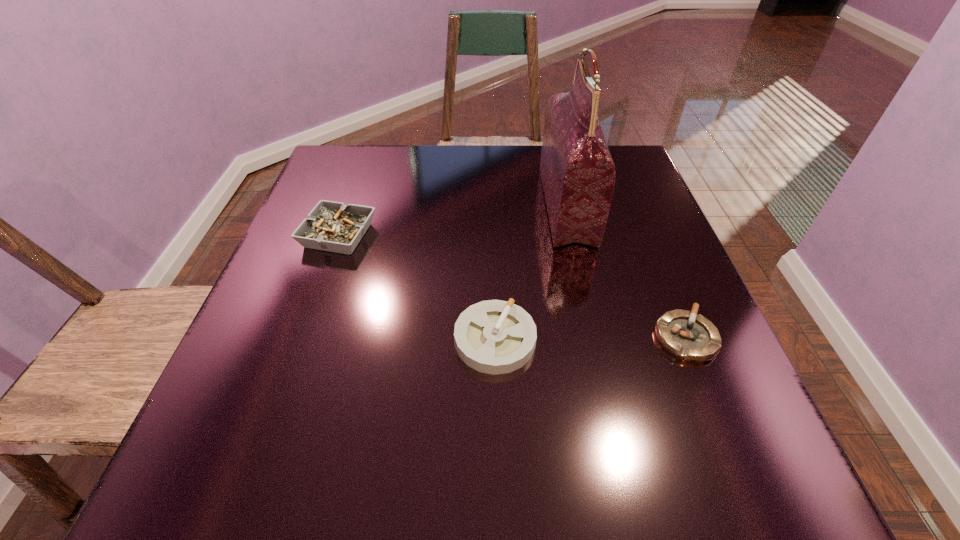
The image size is (960, 540). I want to click on free spot at the right edge of the desktop, so click(636, 199).

The width and height of the screenshot is (960, 540). I want to click on vacant space at the far left corner of the desktop, so click(349, 184).

I want to click on blank space at the near left corner, so click(x=304, y=449).

At what (x,y) coordinates should I click in order to perform the action: click on free space at the far right corner. Please return your answer as a coordinate pair (x, y). Looking at the image, I should click on (632, 158).

The height and width of the screenshot is (540, 960). In order to click on blank region between the second object from left to right and the shortest object in this screenshot , I will do `click(590, 339)`.

You are a GUI agent. You are given a task and a screenshot of the screen. Output one action in this format:
    pyautogui.click(x=<x>, y=<y>)
    Task: Click on the blank region between the second ashtray from right to left and the farthest ashtray
    The image size is (960, 540).
    Given the screenshot: What is the action you would take?
    pyautogui.click(x=417, y=288)

Find the location of a particular element. This screenshot has width=960, height=540. vacant point located between the rightmost ashtray and the leftmost object is located at coordinates click(512, 286).

Locate an element on the screen. free area in between the shortest ashtray and the second object from left to right is located at coordinates (590, 339).

Image resolution: width=960 pixels, height=540 pixels. Find the location of `vacant area that lies between the leftmost object and the third object from left to right`. vacant area that lies between the leftmost object and the third object from left to right is located at coordinates (452, 221).

The image size is (960, 540). Find the location of `empty space that is in between the tallest object and the shortest ashtray`. empty space that is in between the tallest object and the shortest ashtray is located at coordinates (626, 272).